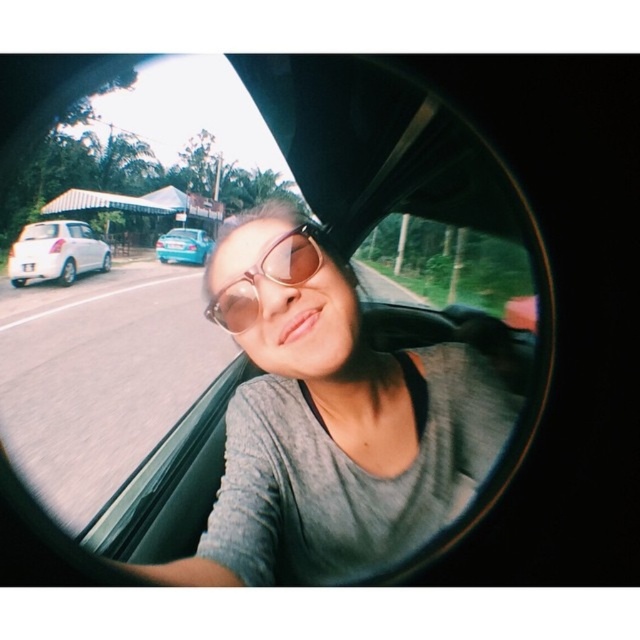
Consider the image. Which is above, matte gray shirt at center or white matte hatchback at left?

white matte hatchback at left is higher up.

Which is more to the left, matte gray shirt at center or white matte hatchback at left?

From the viewer's perspective, white matte hatchback at left appears more on the left side.

The height and width of the screenshot is (640, 640). I want to click on matte gray shirt at center, so click(330, 420).

Between point (300, 472) and point (264, 252), which one is positioned in front?

Point (264, 252)

Can you confirm if matte gray shirt at center is thinner than sunglasses at center?

No, matte gray shirt at center is not thinner than sunglasses at center.

Does point (365, 564) come closer to viewer compared to point (323, 248)?

No, (365, 564) is behind (323, 248).

Find the location of `matte gray shirt at center`. matte gray shirt at center is located at coordinates (330, 420).

The height and width of the screenshot is (640, 640). I want to click on transparent glass car window at center, so click(289, 339).

Does transparent glass car window at center appear on the left side of teal glossy car at left?

Incorrect, transparent glass car window at center is not on the left side of teal glossy car at left.

Is point (294, 260) positioned behind point (157, 237)?

No, it is in front of (157, 237).

Identify the location of transparent glass car window at center. Image resolution: width=640 pixels, height=640 pixels. (289, 339).